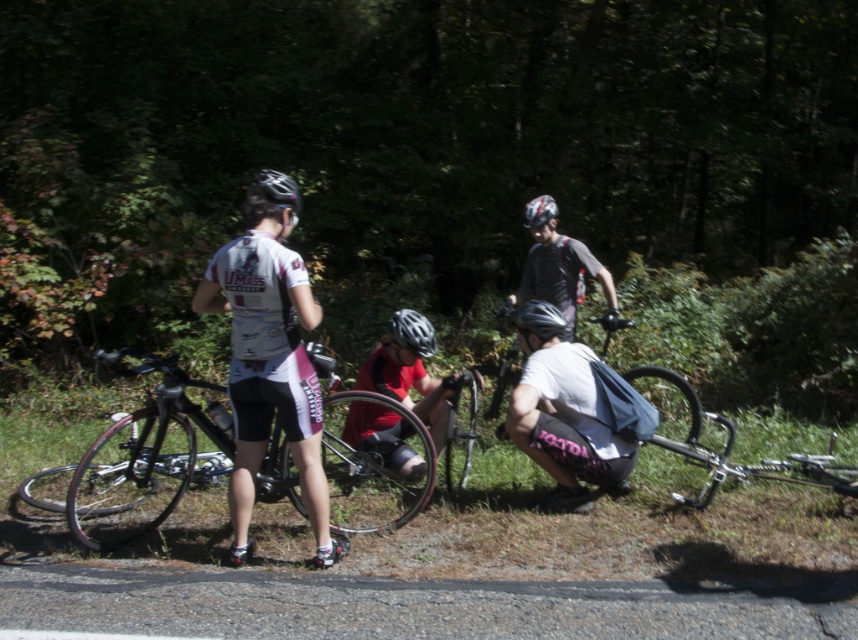
You are a cyclist who wants to choose a helmet that fits better. You see a white matte bicycle helmet at center and a matte black helmet at upper center. Which helmet has a larger size?

The white matte bicycle helmet at center is bigger than the matte black helmet at upper center, so it has a larger size.

You are a photographer standing at the center of the scene. You want to take a photo that includes both point (275,422) and point (547,216). Which point will appear larger in your photo?

Point (275,422) is closer to the camera than point (547,216), so it will appear larger in the photo.

You are a photographer trying to capture a photo of the shiny black bicycle at center and the shiny silver helmet at center from above. Which object will appear larger in the photo?

The shiny black bicycle at center is taller than the shiny silver helmet at center, so it will appear larger in the photo taken from above.